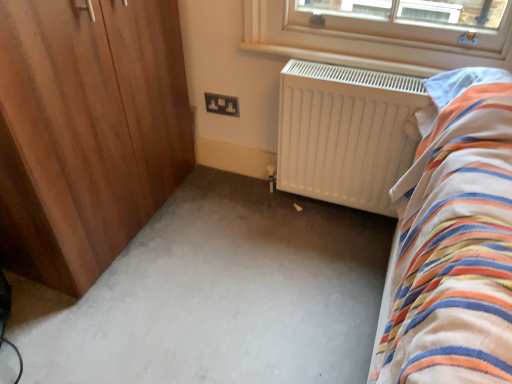
Question: From a real-world perspective, is white carpet at center under white matte radiator at center?

Choices:
 (A) yes
 (B) no

Answer: (A)

Question: Is white carpet at center wider than white matte radiator at center?

Choices:
 (A) no
 (B) yes

Answer: (B)

Question: Would you say white carpet at center contains white matte radiator at center?

Choices:
 (A) no
 (B) yes

Answer: (A)

Question: Is white carpet at center closer to the viewer compared to white matte radiator at center?

Choices:
 (A) yes
 (B) no

Answer: (A)

Question: Is white carpet at center oriented towards white matte radiator at center?

Choices:
 (A) yes
 (B) no

Answer: (B)

Question: Is white carpet at center not near white matte radiator at center?

Choices:
 (A) no
 (B) yes

Answer: (A)

Question: Is white matte radiator at center placed right next to wooden wardrobe at left?

Choices:
 (A) no
 (B) yes

Answer: (A)

Question: Considering the relative sizes of white matte radiator at center and wooden wardrobe at left in the image provided, is white matte radiator at center thinner than wooden wardrobe at left?

Choices:
 (A) yes
 (B) no

Answer: (A)

Question: Does white matte radiator at center lie behind wooden wardrobe at left?

Choices:
 (A) no
 (B) yes

Answer: (B)

Question: Considering the relative sizes of white matte radiator at center and wooden wardrobe at left in the image provided, is white matte radiator at center wider than wooden wardrobe at left?

Choices:
 (A) no
 (B) yes

Answer: (A)

Question: Is white matte radiator at center not near wooden wardrobe at left?

Choices:
 (A) yes
 (B) no

Answer: (B)

Question: Is white matte radiator at center positioned with its back to wooden wardrobe at left?

Choices:
 (A) no
 (B) yes

Answer: (A)

Question: Can you confirm if wooden wardrobe at left is shorter than black plastic socket at center?

Choices:
 (A) yes
 (B) no

Answer: (B)